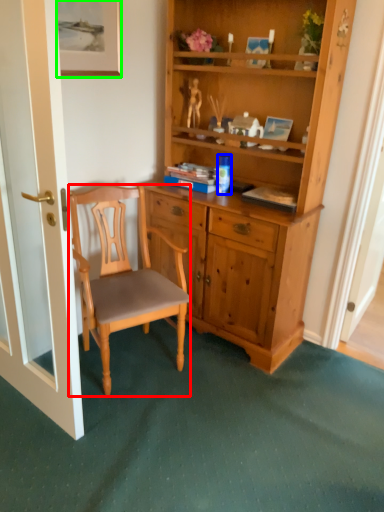
Question: Considering the real-world distances, which object is closest to chair (highlighted by a red box)? coffee cup (highlighted by a blue box) or picture frame (highlighted by a green box).

Choices:
 (A) coffee cup
 (B) picture frame

Answer: (A)